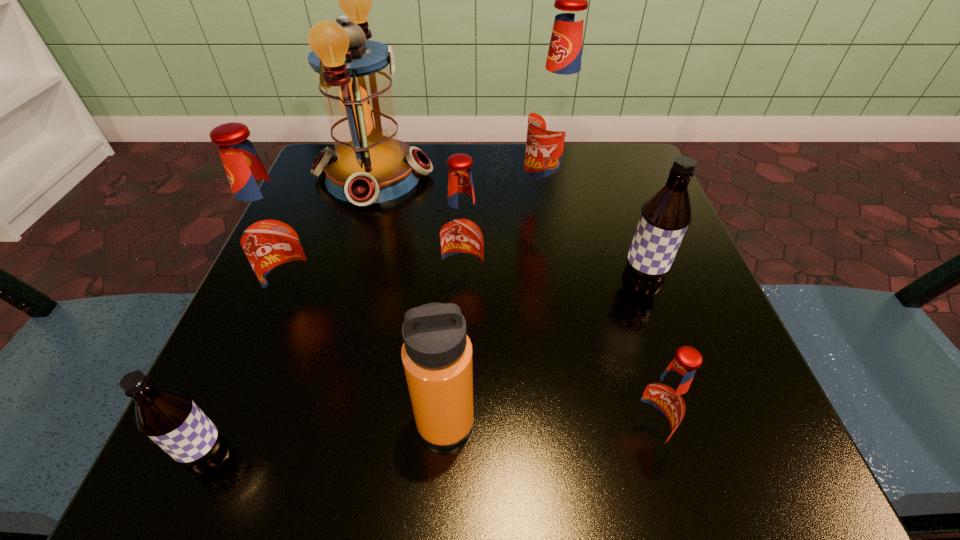
Find the location of a particular element. the nearest red root beer is located at coordinates (662, 404).

Find the location of a particular element. the nearer brown root beer is located at coordinates (169, 417).

Where is `the smaller brown root beer`? the smaller brown root beer is located at coordinates (169, 417).

Where is `free space located on the left of the farthest root beer`? free space located on the left of the farthest root beer is located at coordinates (388, 201).

Find the location of a particular element. The image size is (960, 540). blank area located on the front-facing side of the lantern is located at coordinates coord(470,176).

Image resolution: width=960 pixels, height=540 pixels. In order to click on blank space located 0.290m on the right of the second tallest root beer in this screenshot , I will do `click(513, 305)`.

Image resolution: width=960 pixels, height=540 pixels. I want to click on vacant space positioned 0.200m on the back of the bigger brown root beer, so click(x=609, y=204).

The width and height of the screenshot is (960, 540). I want to click on vacant space located on the left of the second smallest red root beer, so click(x=390, y=288).

Find the location of a particular element. The image size is (960, 540). free location located 0.360m on the right of the orange thermos bottle is located at coordinates (757, 422).

What are the coordinates of `vacant space located 0.210m on the back of the nearest red root beer` in the screenshot? It's located at (605, 296).